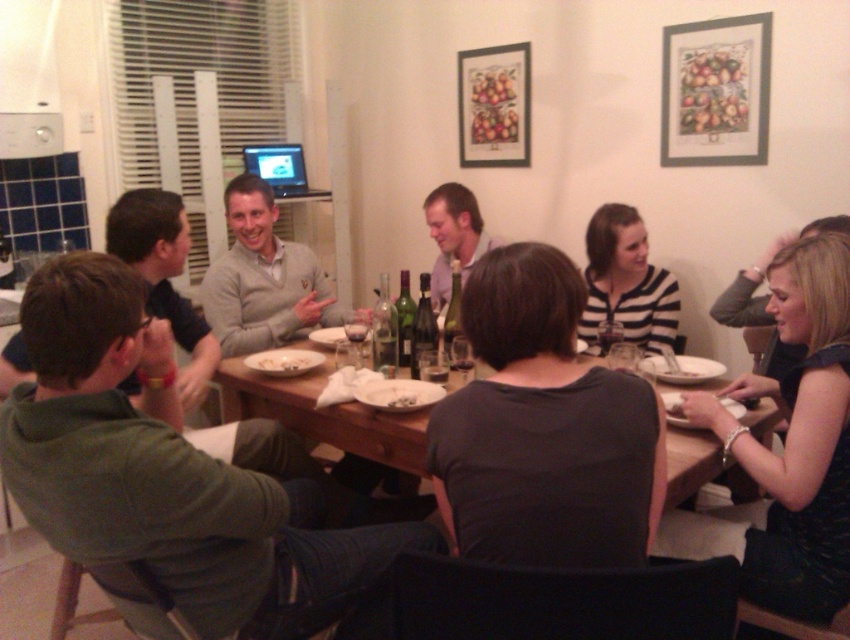
You are standing in the room and want to hang a new painting exactly where the wooden framed print at upper center is currently located. What are the coordinates you should aim for?

The wooden framed print at upper center is located at coordinates (494, 106), so you should aim for those coordinates to hang the new painting.

You are standing in the dining area and want to take a photo of both the point at coordinates [754,451] and the point at [672,74]. Which point should you focus on first to ensure both are in focus?

You should focus on the point at coordinates [754,451] first because it is closer to the camera than the point at [672,74]. This will ensure that both points are within the depth of field and in focus.